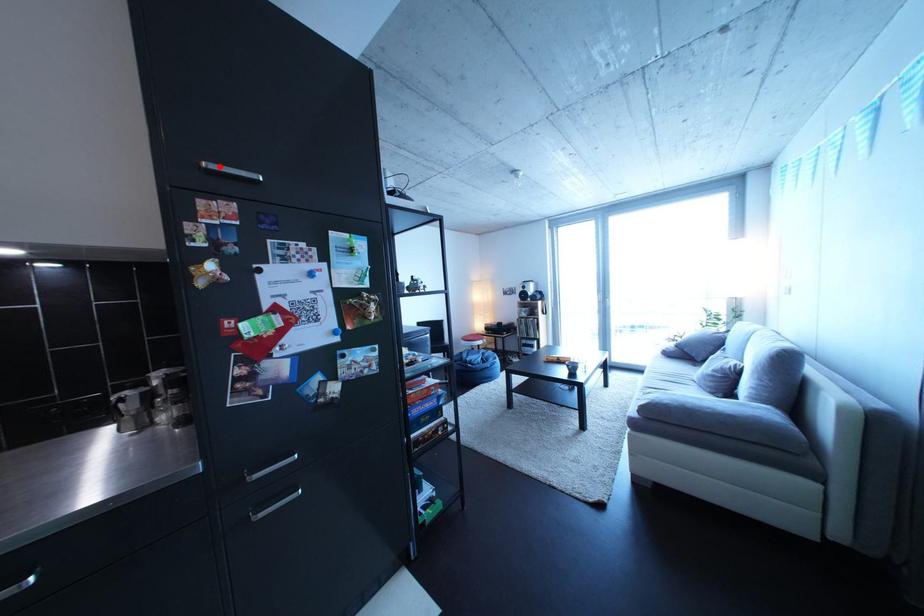
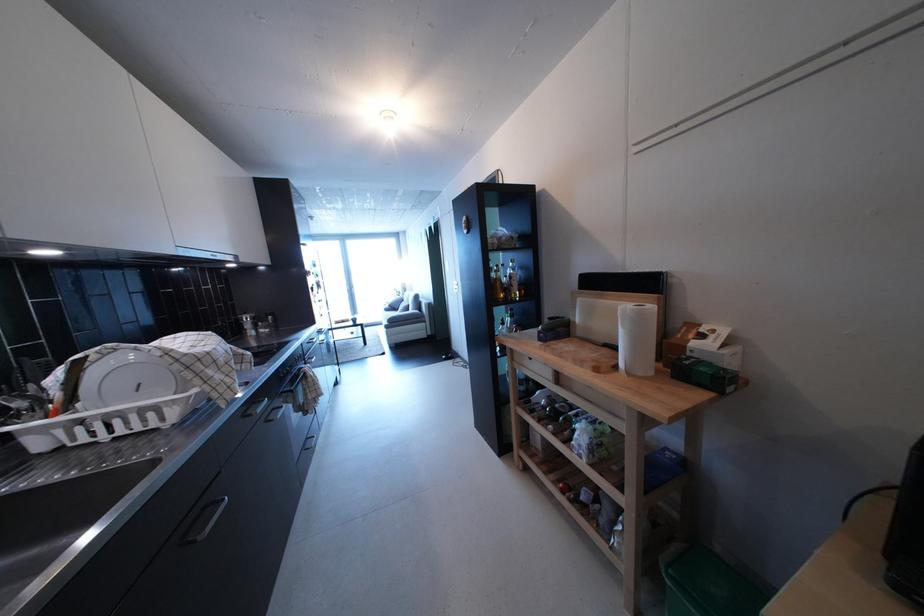
Question: I am providing you with two images of the same scene from different viewpoints. A red point is marked on the first image. Is the red point's position out of view in image 2?

Choices:
 (A) Yes
 (B) No

Answer: (A)